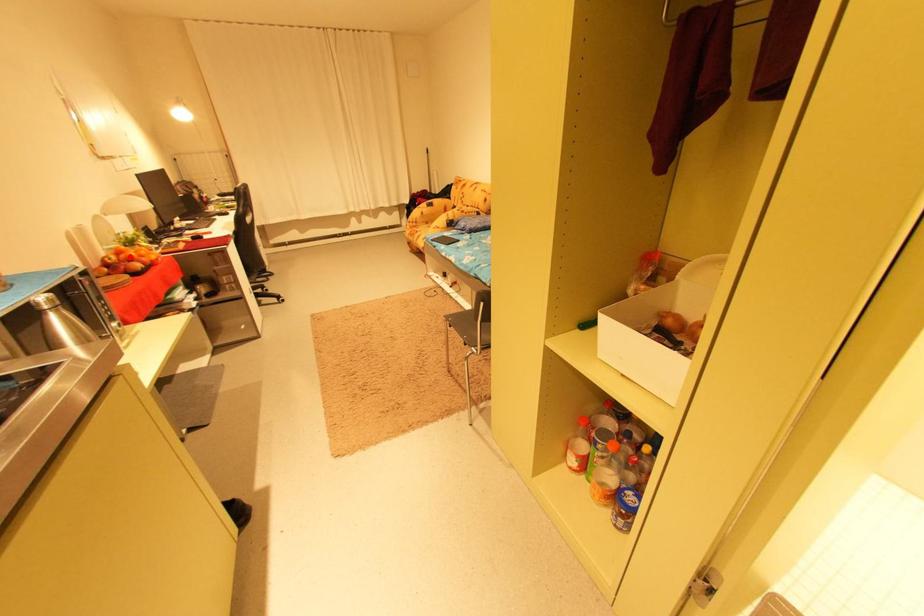
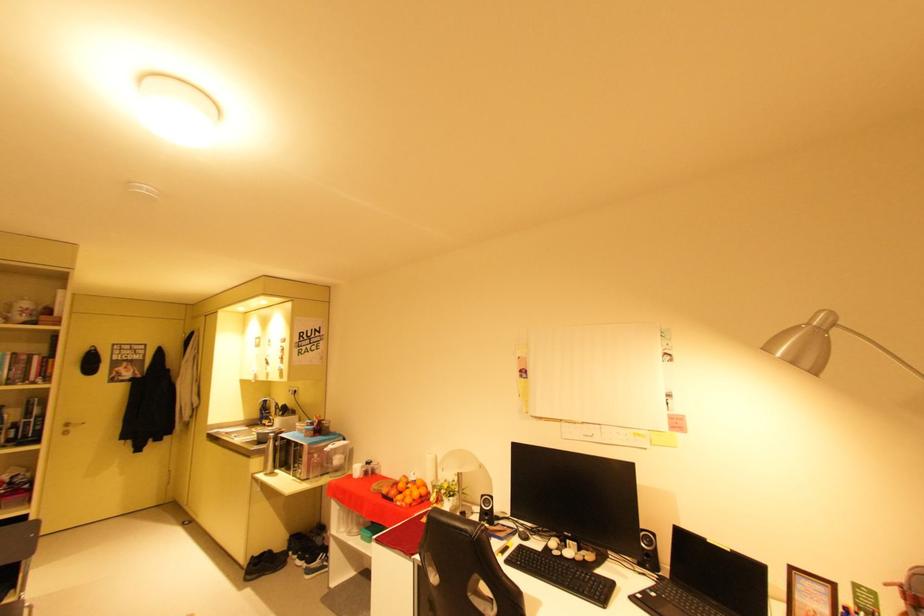
Question: I am providing you with two images of the same scene from different viewpoints. A red point is marked on the first image. Is the red point's position out of view in image 2?

Choices:
 (A) Yes
 (B) No

Answer: (A)